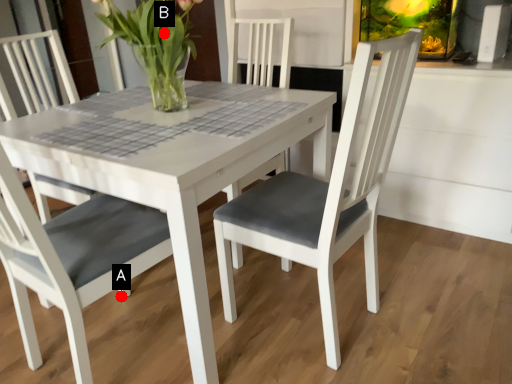
Question: Two points are circled on the image, labeled by A and B beside each circle. Which of the following is the farthest from the observer?

Choices:
 (A) A is further
 (B) B is further

Answer: (A)